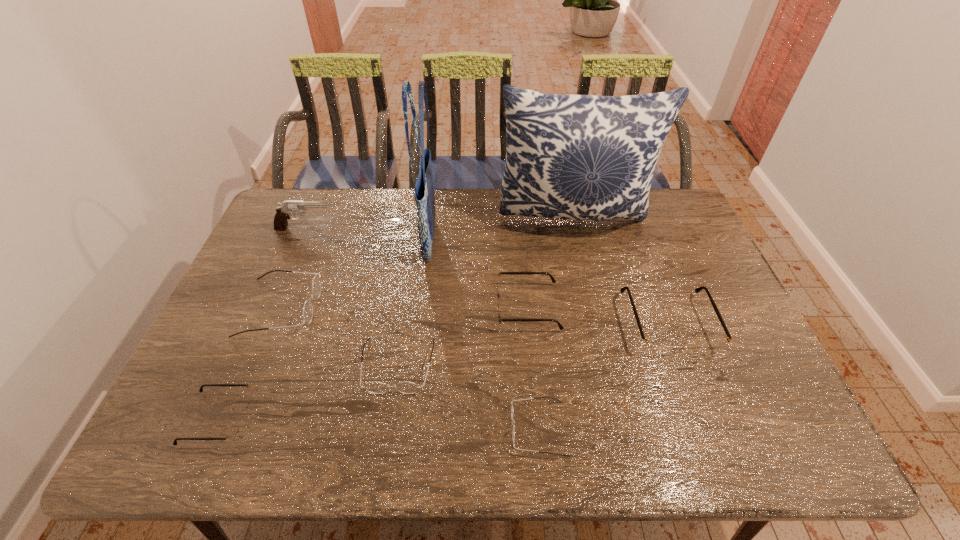
Where is `shopping bag`? The width and height of the screenshot is (960, 540). shopping bag is located at coordinates (x=424, y=190).

Image resolution: width=960 pixels, height=540 pixels. Identify the location of cushion. (580, 157).

At what (x,y) coordinates should I click in order to perform the action: click on the seventh shortest object. Please return your answer as a coordinate pair (x, y). Looking at the image, I should click on (283, 212).

Image resolution: width=960 pixels, height=540 pixels. I want to click on the biggest black spectacles, so click(657, 346).

What are the coordinates of `the rightmost spectacles` in the screenshot? It's located at (657, 346).

This screenshot has width=960, height=540. I want to click on the biggest dark spectacles, so click(316, 284).

Identify the location of the second smallest black spectacles. The image size is (960, 540). (498, 297).

The image size is (960, 540). I want to click on the second smallest dark spectacles, so click(x=374, y=387).

The height and width of the screenshot is (540, 960). I want to click on the third spectacles from left to right, so click(374, 387).

This screenshot has width=960, height=540. In order to click on the leftmost black spectacles in this screenshot , I will do `click(233, 432)`.